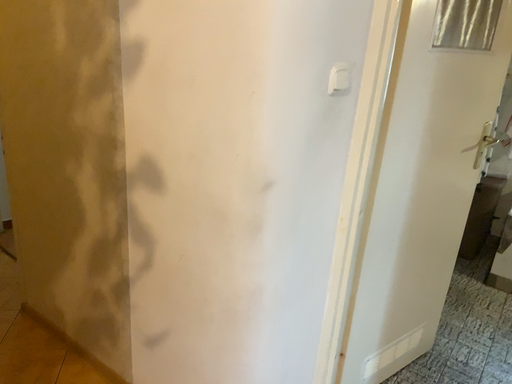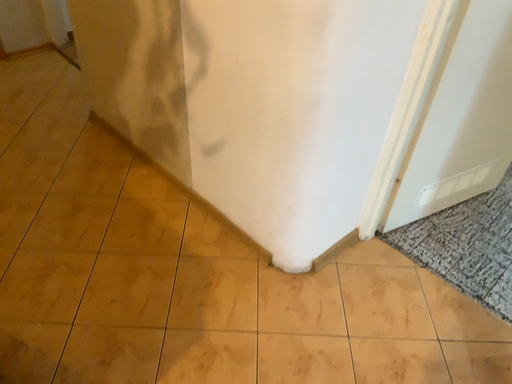
Question: Which way did the camera rotate in the video?

Choices:
 (A) rotated left
 (B) rotated right

Answer: (A)